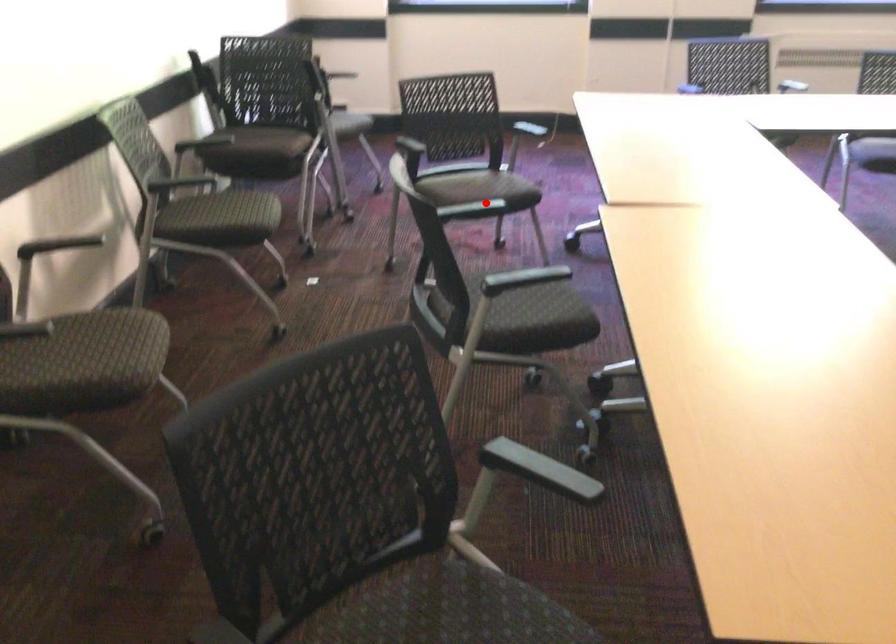
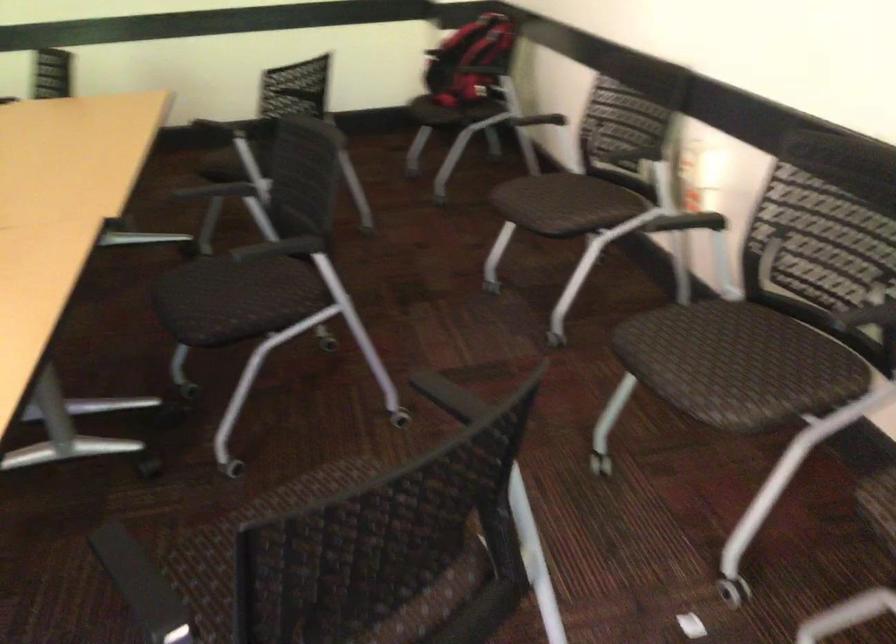
Question: I am providing you with two images of the same scene from different viewpoints. Image1 has a red point marked. In image2, the corresponding 3D location appears at what relative position? Reply with the corresponding letter.

Choices:
 (A) Closer
 (B) Farther

Answer: (A)